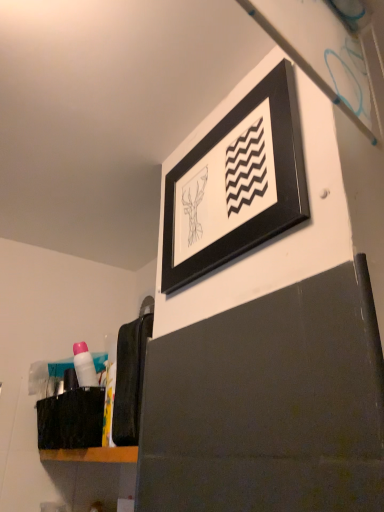
Question: Could black fabric laundry at lower left be considered to be inside pink plastic tube at lower left?

Choices:
 (A) no
 (B) yes

Answer: (A)

Question: Is pink plastic tube at lower left shorter than black fabric laundry at lower left?

Choices:
 (A) yes
 (B) no

Answer: (A)

Question: Is pink plastic tube at lower left aimed at black fabric laundry at lower left?

Choices:
 (A) no
 (B) yes

Answer: (A)

Question: Is pink plastic tube at lower left far away from black fabric laundry at lower left?

Choices:
 (A) yes
 (B) no

Answer: (B)

Question: Is pink plastic tube at lower left to the right of black fabric laundry at lower left from the viewer's perspective?

Choices:
 (A) yes
 (B) no

Answer: (B)

Question: In terms of width, does pink plastic tube at lower left look wider or thinner when compared to black fabric laundry at lower left?

Choices:
 (A) thin
 (B) wide

Answer: (A)

Question: In terms of size, does pink plastic tube at lower left appear bigger or smaller than black fabric laundry at lower left?

Choices:
 (A) big
 (B) small

Answer: (B)

Question: Visually, is pink plastic tube at lower left positioned to the left or to the right of black fabric laundry at lower left?

Choices:
 (A) right
 (B) left

Answer: (B)

Question: Considering the positions of point (82, 368) and point (135, 403), is point (82, 368) closer or farther from the camera than point (135, 403)?

Choices:
 (A) closer
 (B) farther

Answer: (B)

Question: In terms of width, does black fabric laundry at lower left look wider or thinner when compared to black matte picture frame at upper center?

Choices:
 (A) wide
 (B) thin

Answer: (A)

Question: From the image's perspective, relative to black matte picture frame at upper center, is black fabric laundry at lower left above or below?

Choices:
 (A) above
 (B) below

Answer: (B)

Question: Considering the positions of black fabric laundry at lower left and black matte picture frame at upper center in the image, is black fabric laundry at lower left bigger or smaller than black matte picture frame at upper center?

Choices:
 (A) big
 (B) small

Answer: (B)

Question: Is point (124, 374) positioned closer to the camera than point (274, 188)?

Choices:
 (A) closer
 (B) farther

Answer: (B)

Question: In terms of height, does pink plastic tube at lower left look taller or shorter compared to black matte picture frame at upper center?

Choices:
 (A) tall
 (B) short

Answer: (B)

Question: Is point (81, 384) closer or farther from the camera than point (180, 274)?

Choices:
 (A) closer
 (B) farther

Answer: (B)